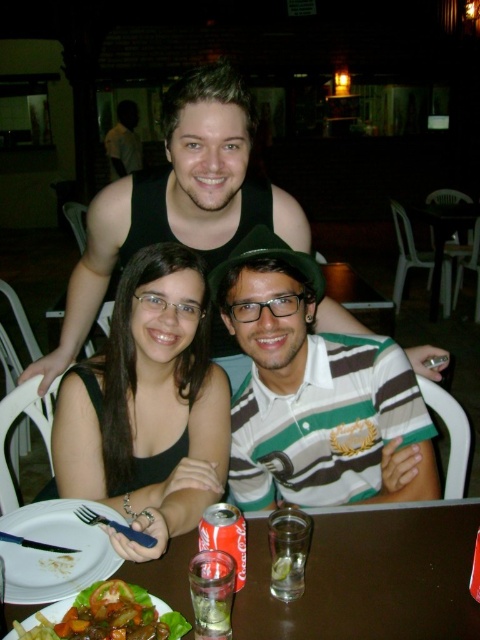
Can you confirm if wooden table at center is bigger than green leafy vegetables at lower left?

Indeed, wooden table at center has a larger size compared to green leafy vegetables at lower left.

Is point (319, 529) positioned behind point (118, 586)?

Yes, it is.

I want to click on wooden table at center, so click(370, 577).

Who is taller, green striped polo shirt at center or matte black tank top at upper center?

matte black tank top at upper center

The height and width of the screenshot is (640, 480). I want to click on green striped polo shirt at center, so click(x=312, y=392).

Identify the location of green striped polo shirt at center. (312, 392).

Who is lower down, black matte tank top at center or wooden table at center?

wooden table at center is below.

The height and width of the screenshot is (640, 480). I want to click on black matte tank top at center, so click(x=147, y=406).

Who is more forward, [169,285] or [425,582]?

Point [425,582] is more forward.

The width and height of the screenshot is (480, 640). What are the coordinates of `black matte tank top at center` in the screenshot? It's located at (147, 406).